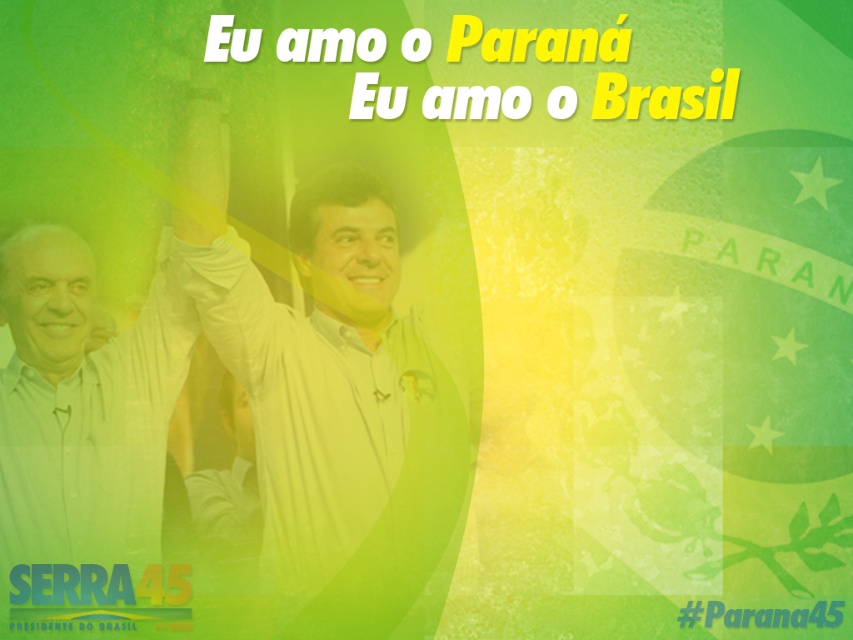
Question: Which point is closer to the camera?

Choices:
 (A) (33, 566)
 (B) (318, 51)
 (C) (444, 588)

Answer: (A)

Question: Is white shirt at center above #parana45 at center?

Choices:
 (A) no
 (B) yes

Answer: (B)

Question: Does whitematerial/texturetext at upper center appear under #parana45 at center?

Choices:
 (A) no
 (B) yes

Answer: (A)

Question: Can you confirm if whitematerial/texturetext at upper center is positioned below green plastic text at lower left?

Choices:
 (A) yes
 (B) no

Answer: (B)

Question: Which object is positioned farthest from the white shirt at center?

Choices:
 (A) #parana45 at center
 (B) whitematerial/texturetext at upper center
 (C) green plastic text at lower left

Answer: (A)

Question: Which object is positioned farthest from the green plastic text at lower left?

Choices:
 (A) whitematerial/texturetext at upper center
 (B) #parana45 at center

Answer: (B)